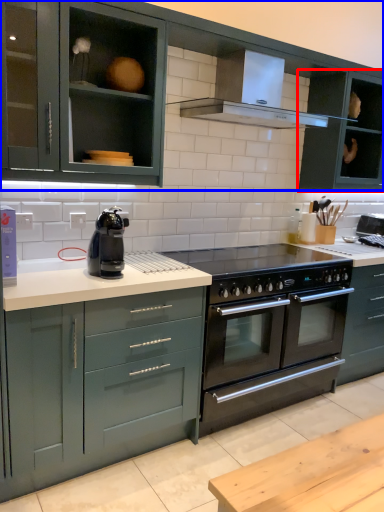
Question: Which of the following is the closest to the observer, cabinetry (highlighted by a red box) or cabinetry (highlighted by a blue box)?

Choices:
 (A) cabinetry
 (B) cabinetry

Answer: (B)